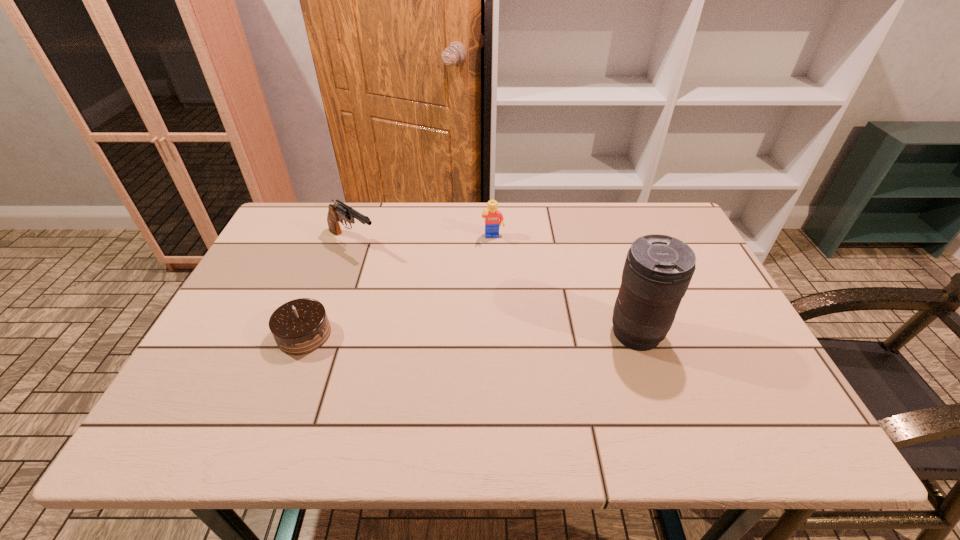
Where is `vacant space on the desktop that is between the shortest object and the rightmost object and is positioned on the face of the Lego`? vacant space on the desktop that is between the shortest object and the rightmost object and is positioned on the face of the Lego is located at coordinates (507, 334).

Identify the location of free spot on the desktop that is between the chocolate cake and the rightmost object and is positioned along the barrel of the gun. The image size is (960, 540). (494, 334).